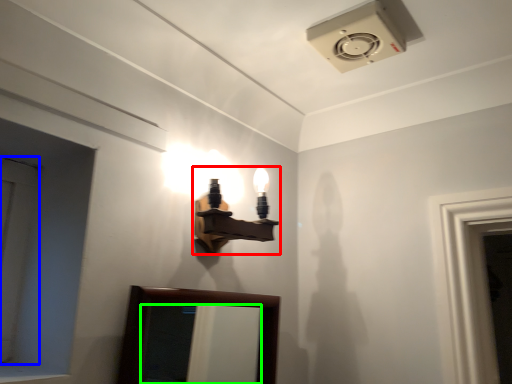
Question: Which is nearer to the lamp (highlighted by a red box)? door (highlighted by a blue box) or mirror (highlighted by a green box).

Choices:
 (A) door
 (B) mirror

Answer: (A)